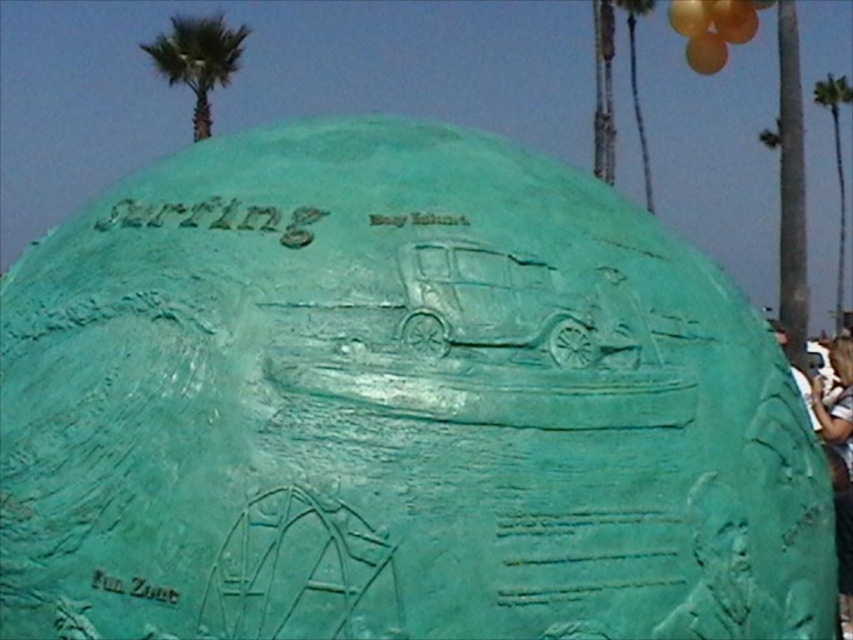
Question: Which object appears closest to the camera in this image?

Choices:
 (A) orange matte balloons at upper right
 (B) green textured palm tree at upper left
 (C) green bronze statue at center

Answer: (C)

Question: From the image, what is the correct spatial relationship of green bronze statue at center in relation to translucent orange balloon at upper right?

Choices:
 (A) right
 (B) left

Answer: (B)

Question: Among these objects, which one is nearest to the camera?

Choices:
 (A) green textured palm tree at right
 (B) orange matte balloons at upper right
 (C) green bronze statue at center
 (D) green textured palm tree at upper left

Answer: (C)

Question: In this image, where is green textured palm tree at upper left located relative to orange matte balloons at upper right?

Choices:
 (A) below
 (B) above

Answer: (B)

Question: Can you confirm if green textured palm tree at upper left is wider than translucent orange balloon at upper right?

Choices:
 (A) yes
 (B) no

Answer: (A)

Question: Which of the following is the closest to the observer?

Choices:
 (A) (825, 394)
 (B) (653, 4)
 (C) (722, 52)
 (D) (512, 308)

Answer: (D)